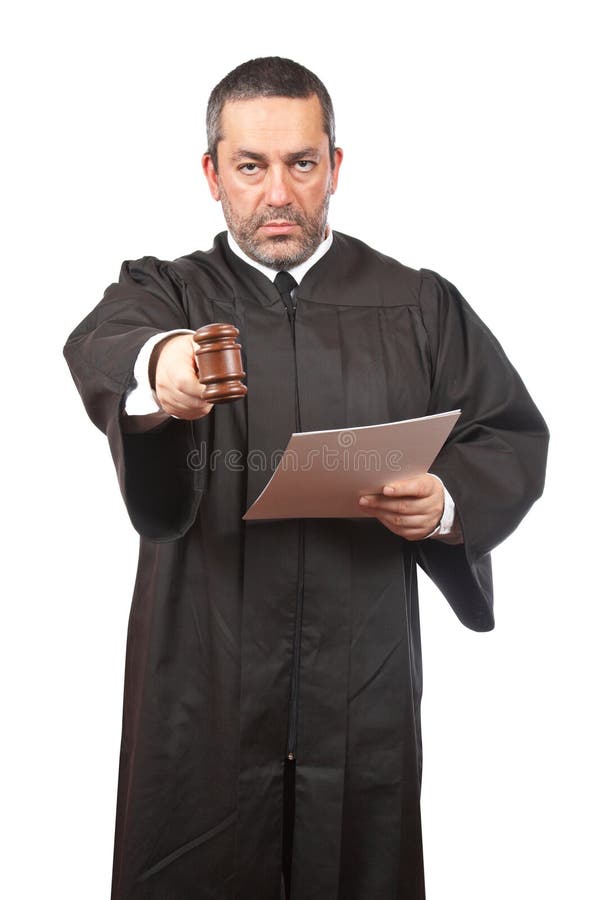
Locate an element on the screen. The height and width of the screenshot is (900, 600). knot of dark necktie, center top is located at coordinates (289, 284).